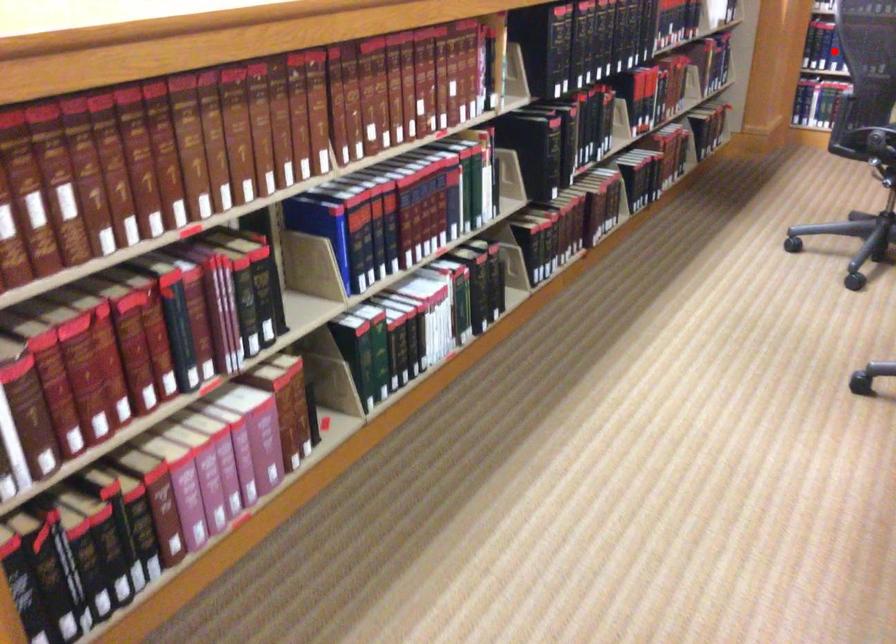
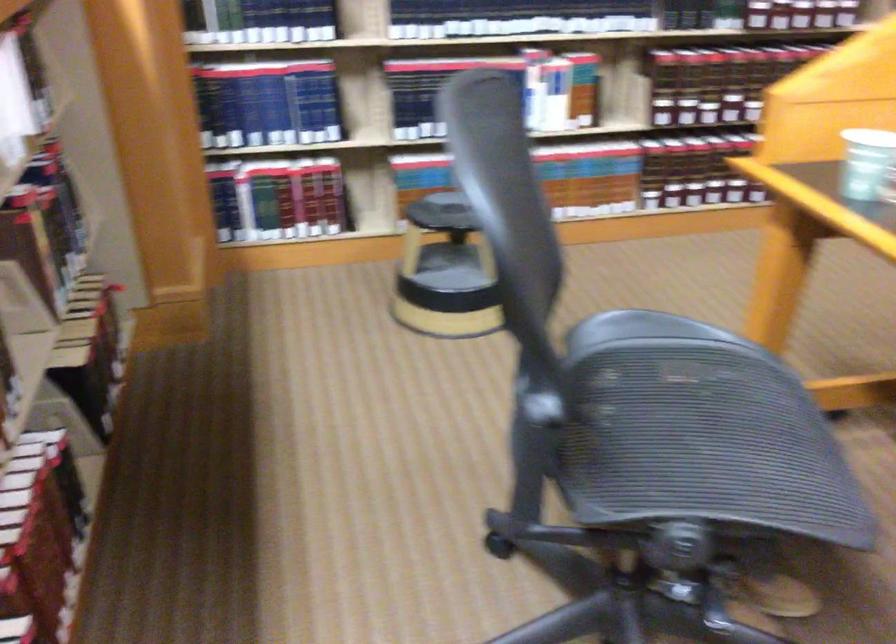
Question: I am providing you with two images of the same scene from different viewpoints. A red point is marked on the first image. Can you still see the location of the red point in image 2?

Choices:
 (A) Yes
 (B) No

Answer: (B)